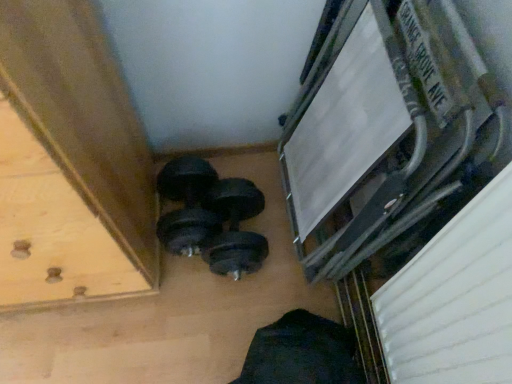
Locate an element on the screen. vacant region in front of black rubber dumbbell at lower center, which is counted as the first dumbbell, starting from the left is located at coordinates (184, 299).